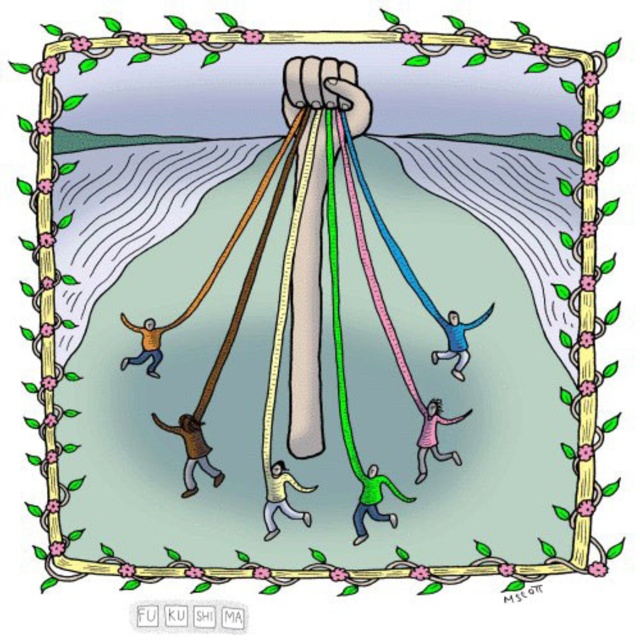
Question: Can you confirm if brown matte pants at lower left is positioned to the right of light blue fabric at lower center?

Choices:
 (A) yes
 (B) no

Answer: (B)

Question: Which of these objects is positioned farthest from the pink matte figure at center?

Choices:
 (A) blue fabric at center
 (B) brown matte pants at lower left
 (C) light blue fabric at lower center
 (D) orange matte sweater at lower left

Answer: (D)

Question: Among these objects, which one is nearest to the camera?

Choices:
 (A) blue fabric at center
 (B) green matte person at center

Answer: (B)

Question: Which point is closer to the camera taking this photo?

Choices:
 (A) (209, 467)
 (B) (460, 342)
 (C) (371, 468)
 (D) (154, 348)

Answer: (D)

Question: Does blue fabric at center appear over orange matte sweater at lower left?

Choices:
 (A) yes
 (B) no

Answer: (A)

Question: Can you confirm if brown matte pants at lower left is positioned to the right of pink matte figure at center?

Choices:
 (A) no
 (B) yes

Answer: (A)